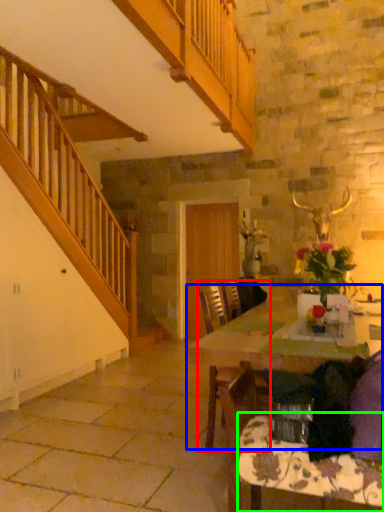
Question: Estimate the real-world distances between objects in this image. Which object is farther from chair (highlighted by a red box), table (highlighted by a blue box) or tablecloth (highlighted by a green box)?

Choices:
 (A) table
 (B) tablecloth

Answer: (B)